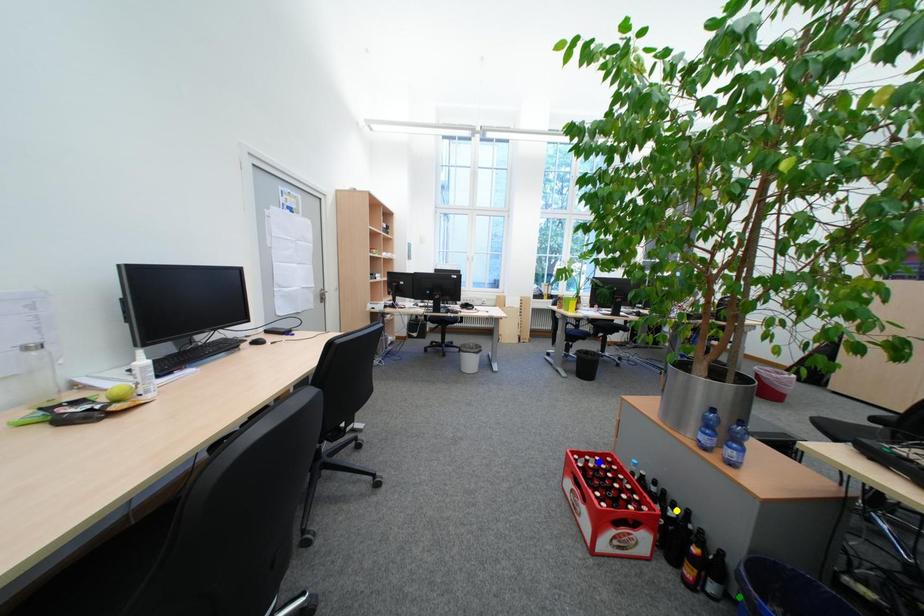
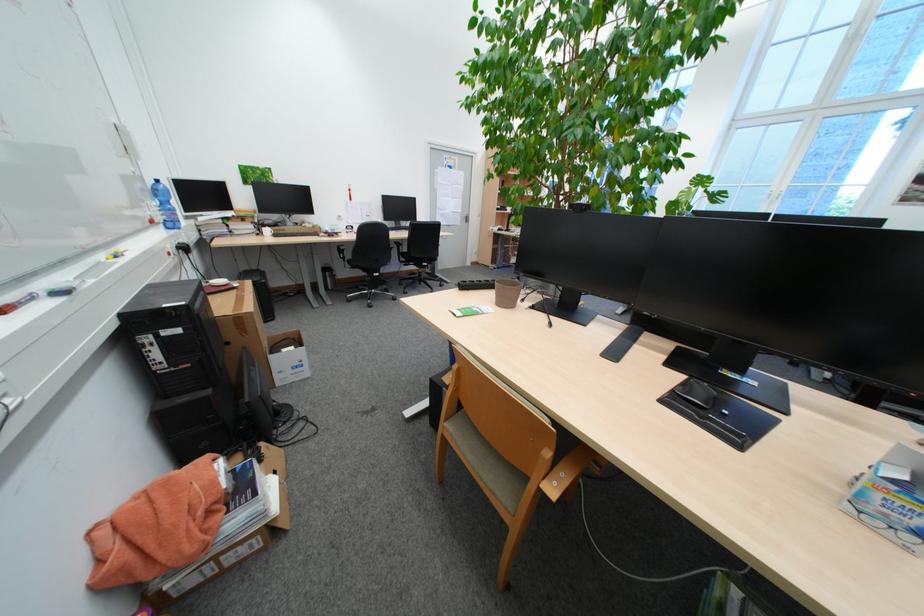
I am providing you with two images of the same scene from different viewpoints. Three points are marked in image1. Which point corresponds to a part or object that is occluded in image2?In image1, three points are marked. Which of them correspond to a part or object that is occluded in image2?Among the three points shown in image1, which one corresponds to a part or object that is no longer visible due to occlusion in image2?

Invisible in image2: green point, yellow point, blue point.